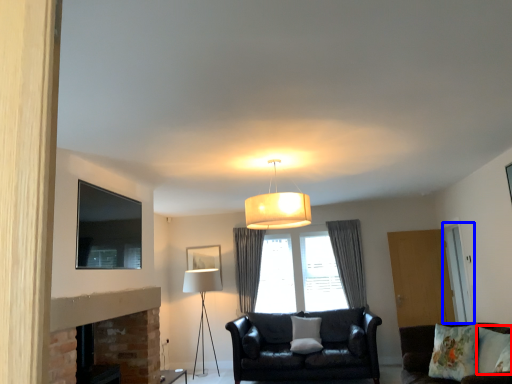
Question: Among these objects, which one is nearest to the camera, pillow (highlighted by a red box) or glass door (highlighted by a blue box)?

Choices:
 (A) pillow
 (B) glass door

Answer: (A)